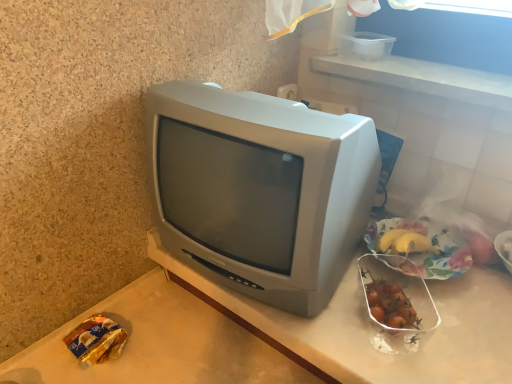
Question: From a real-world perspective, does matte gray television at center stand above gold foil snack at lower left, placed as the 1th food when sorted from left to right?

Choices:
 (A) yes
 (B) no

Answer: (A)

Question: Is matte gray television at center looking in the opposite direction of gold foil snack at lower left, the 4th food when ordered from right to left?

Choices:
 (A) yes
 (B) no

Answer: (B)

Question: From a real-world perspective, is matte gray television at center beneath gold foil snack at lower left, the 4th food when ordered from right to left?

Choices:
 (A) no
 (B) yes

Answer: (A)

Question: Does matte gray television at center have a lesser width compared to gold foil snack at lower left, the 4th food when ordered from right to left?

Choices:
 (A) yes
 (B) no

Answer: (B)

Question: Considering the relative sizes of matte gray television at center and gold foil snack at lower left, the 4th food when ordered from right to left, in the image provided, is matte gray television at center smaller than gold foil snack at lower left, the 4th food when ordered from right to left,?

Choices:
 (A) yes
 (B) no

Answer: (B)

Question: Can you confirm if matte gray television at center is shorter than gold foil snack at lower left, the 4th food when ordered from right to left?

Choices:
 (A) no
 (B) yes

Answer: (A)

Question: Are gold foil snack at lower left, placed as the 1th food when sorted from left to right, and matte gray television at center far apart?

Choices:
 (A) no
 (B) yes

Answer: (A)

Question: Is gold foil snack at lower left, placed as the 1th food when sorted from left to right, aimed at matte gray television at center?

Choices:
 (A) no
 (B) yes

Answer: (A)

Question: From a real-world perspective, does gold foil snack at lower left, the 4th food when ordered from right to left, stand above matte gray television at center?

Choices:
 (A) yes
 (B) no

Answer: (B)

Question: Does gold foil snack at lower left, the 4th food when ordered from right to left, have a greater height compared to matte gray television at center?

Choices:
 (A) yes
 (B) no

Answer: (B)

Question: Is gold foil snack at lower left, placed as the 1th food when sorted from left to right, wider than matte gray television at center?

Choices:
 (A) yes
 (B) no

Answer: (B)

Question: Is gold foil snack at lower left, the 4th food when ordered from right to left, not inside matte gray television at center?

Choices:
 (A) yes
 (B) no

Answer: (A)

Question: Does translucent plastic banana at upper right, the 1th food positioned from the right, have a lesser width compared to shiny plastic container of cherry tomatoes at right, the third food in the right-to-left sequence?

Choices:
 (A) yes
 (B) no

Answer: (A)